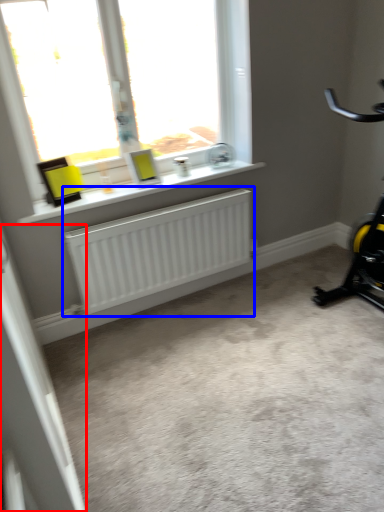
Question: Among these objects, which one is nearest to the camera, screen door (highlighted by a red box) or radiator (highlighted by a blue box)?

Choices:
 (A) screen door
 (B) radiator

Answer: (A)